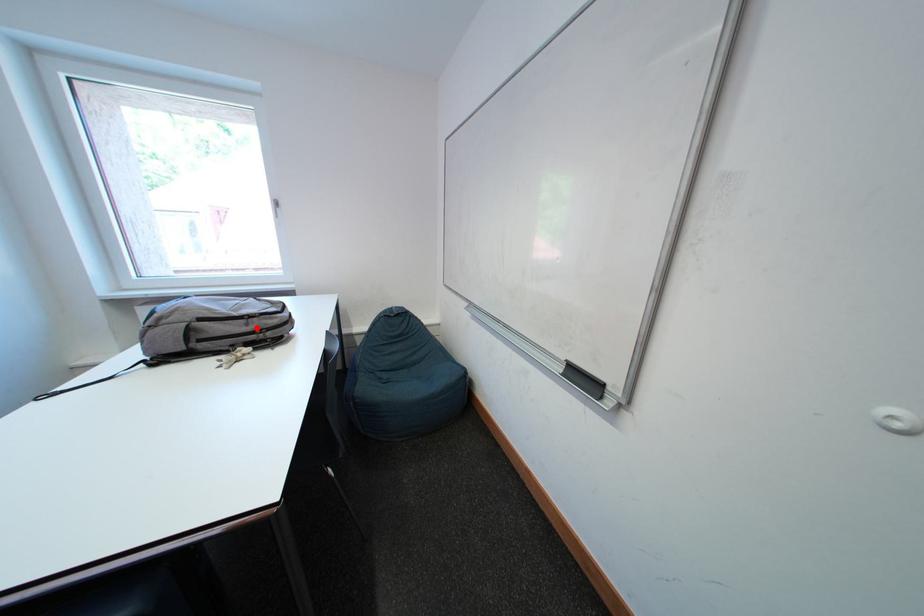
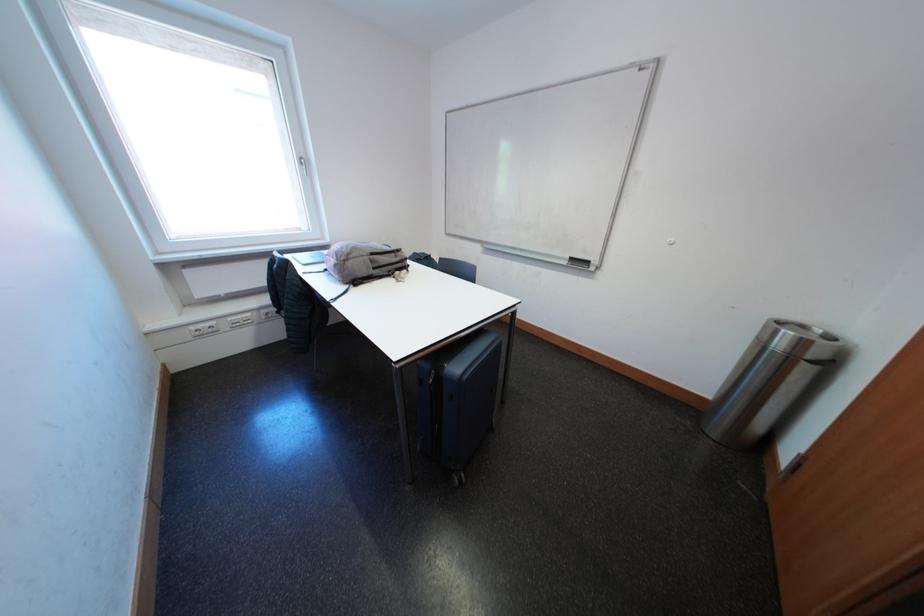
Where in the second image is the point corresponding to the highlighted location from the first image?

(406, 261)